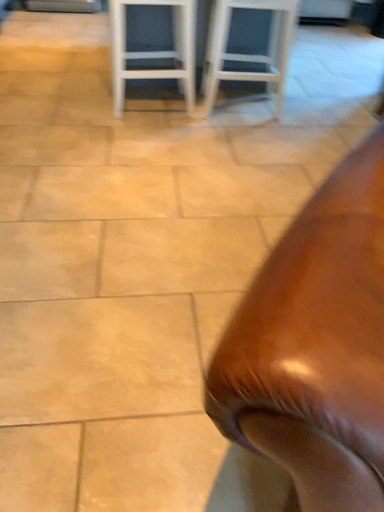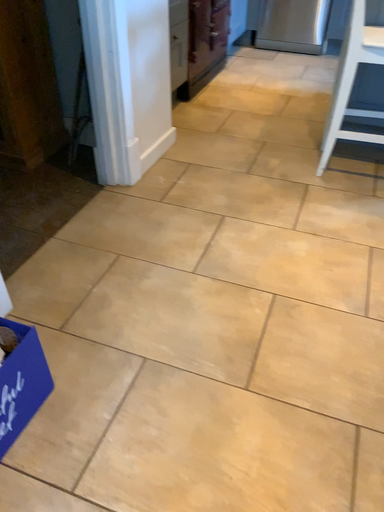
Question: Which way did the camera rotate in the video?

Choices:
 (A) rotated left
 (B) rotated right

Answer: (A)